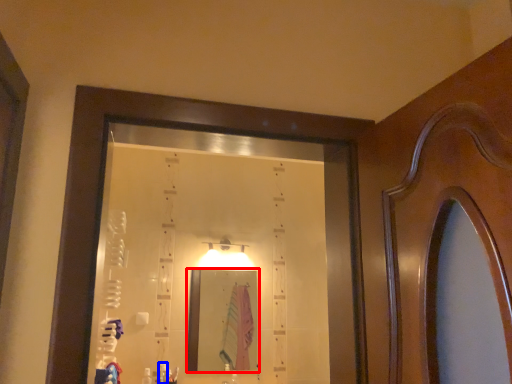
Question: Which object appears farthest to the camera in this image, mirror (highlighted by a red box) or toiletry (highlighted by a blue box)?

Choices:
 (A) mirror
 (B) toiletry

Answer: (A)